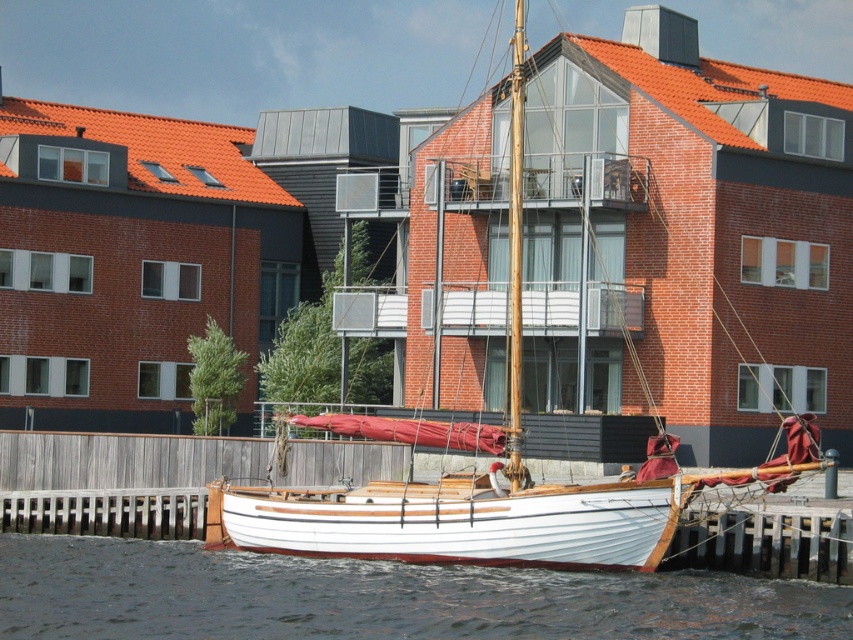
Which of these two, white wood sailboat at center or white smooth water at lower center, stands taller?

white wood sailboat at center is taller.

Between point (780, 161) and point (421, 564), which one is positioned in front?

Positioned in front is point (421, 564).

Locate an element on the screen. The height and width of the screenshot is (640, 853). white wood sailboat at center is located at coordinates (607, 298).